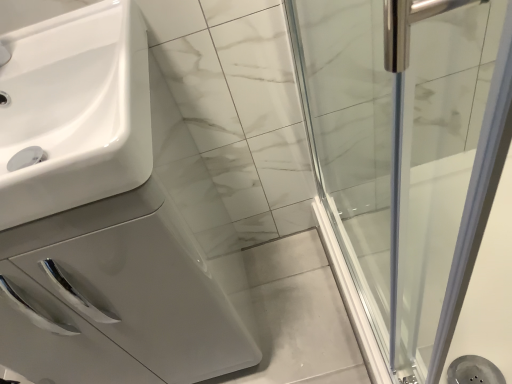
Question: Should I look upward or downward to see white glossy sink at left?

Choices:
 (A) up
 (B) down

Answer: (B)

Question: Is white glossy sink at left not near white glossy sink at left?

Choices:
 (A) no
 (B) yes

Answer: (A)

Question: Considering the relative sizes of white glossy sink at left and white glossy sink at left in the image provided, is white glossy sink at left shorter than white glossy sink at left?

Choices:
 (A) yes
 (B) no

Answer: (A)

Question: From the image's perspective, is white glossy sink at left on top of white glossy sink at left?

Choices:
 (A) yes
 (B) no

Answer: (A)

Question: Considering the relative positions of white glossy sink at left and white glossy sink at left in the image provided, is white glossy sink at left behind white glossy sink at left?

Choices:
 (A) yes
 (B) no

Answer: (B)

Question: From a real-world perspective, is white glossy sink at left located beneath white glossy sink at left?

Choices:
 (A) no
 (B) yes

Answer: (A)

Question: Does white glossy sink at left have a smaller size compared to white glossy sink at left?

Choices:
 (A) yes
 (B) no

Answer: (A)

Question: Is white glossy sink at left bigger than white glossy sink at left?

Choices:
 (A) yes
 (B) no

Answer: (A)

Question: Is white glossy sink at left closer to the viewer compared to white glossy sink at left?

Choices:
 (A) no
 (B) yes

Answer: (A)

Question: From a real-world perspective, is white glossy sink at left positioned over white glossy sink at left based on gravity?

Choices:
 (A) yes
 (B) no

Answer: (B)

Question: Is white glossy sink at left next to white glossy sink at left and touching it?

Choices:
 (A) no
 (B) yes

Answer: (A)

Question: Is white glossy sink at left at the right side of white glossy sink at left?

Choices:
 (A) no
 (B) yes

Answer: (B)

Question: Is white glossy sink at left not inside white glossy sink at left?

Choices:
 (A) no
 (B) yes

Answer: (B)

Question: Looking at their shapes, would you say white glossy sink at left is wider or thinner than white glossy sink at left?

Choices:
 (A) thin
 (B) wide

Answer: (B)